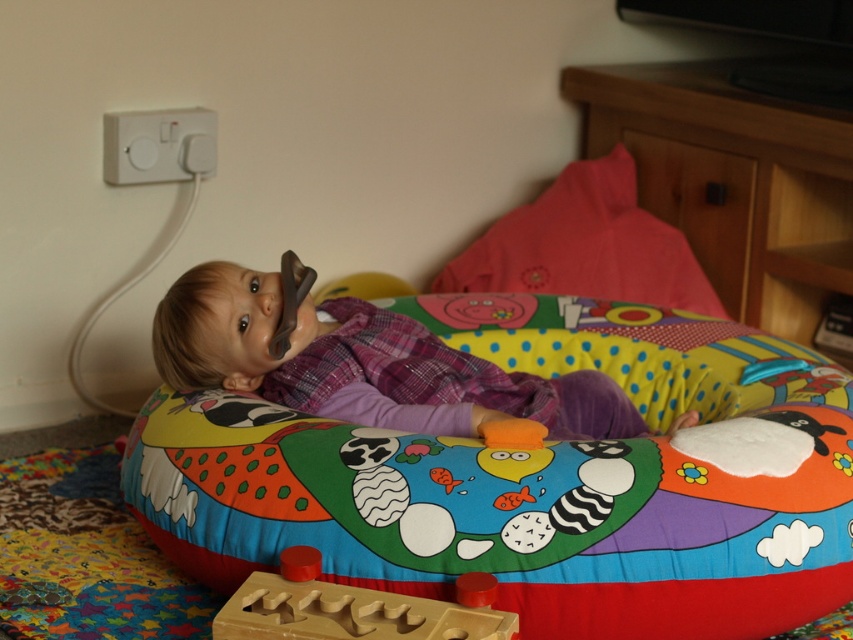
Is point (167, 346) farther from viewer compared to point (509, 632)?

Yes, it is behind point (509, 632).

Who is lower down, matte plastic baby at center or wooden puzzle piece at lower center?

wooden puzzle piece at lower center is lower down.

Between point (173, 291) and point (265, 637), which one is positioned in front?

Point (265, 637) is in front.

You are a GUI agent. You are given a task and a screenshot of the screen. Output one action in this format:
    pyautogui.click(x=<x>, y=<y>)
    Task: Click on the matte plastic baby at center
    
    Given the screenshot: What is the action you would take?
    pyautogui.click(x=361, y=364)

From the picture: Does multicolored fabric bean bag at center have a smaller size compared to matte plastic baby at center?

No, multicolored fabric bean bag at center is not smaller than matte plastic baby at center.

Is point (184, 483) positioned after point (398, 360)?

No, (184, 483) is closer to viewer.

Find the location of a particular element. This screenshot has height=640, width=853. multicolored fabric bean bag at center is located at coordinates (x=538, y=481).

Between multicolored fabric bean bag at center and wooden puzzle piece at lower center, which one is positioned higher?

multicolored fabric bean bag at center is above.

Can you confirm if multicolored fabric bean bag at center is positioned to the left of wooden puzzle piece at lower center?

No, multicolored fabric bean bag at center is not to the left of wooden puzzle piece at lower center.

The image size is (853, 640). What do you see at coordinates (538, 481) in the screenshot?
I see `multicolored fabric bean bag at center` at bounding box center [538, 481].

Where is `multicolored fabric bean bag at center`? This screenshot has width=853, height=640. multicolored fabric bean bag at center is located at coordinates (538, 481).